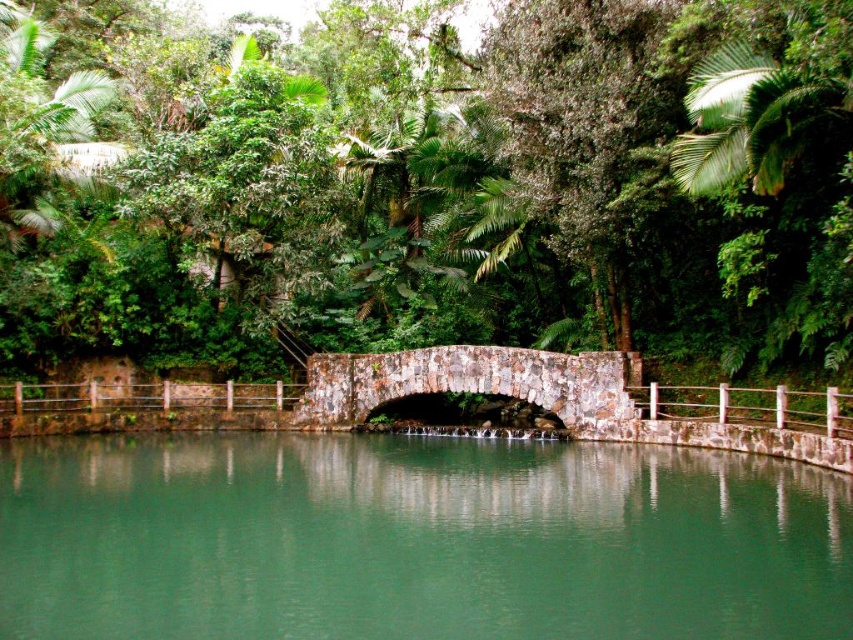
Is green leafy tree at center to the left of rustic stone bridge at center from the viewer's perspective?

Indeed, green leafy tree at center is positioned on the left side of rustic stone bridge at center.

Is green leafy tree at center thinner than rustic stone bridge at center?

Incorrect, green leafy tree at center's width is not less than rustic stone bridge at center's.

Which is in front, point (476, 184) or point (540, 365)?

Point (540, 365) is more forward.

This screenshot has width=853, height=640. In order to click on green leafy tree at center in this screenshot , I will do `click(440, 189)`.

Is the position of green leafy tree at center more distant than that of green stone river at center?

Yes.

What do you see at coordinates (440, 189) in the screenshot?
I see `green leafy tree at center` at bounding box center [440, 189].

Between point (299, 273) and point (595, 492), which one is positioned behind?

The point (299, 273) is behind.

I want to click on green leafy tree at center, so 440,189.

Is point (718, 243) positioned behind point (840, 296)?

Yes, it is behind point (840, 296).

The image size is (853, 640). What do you see at coordinates (440, 189) in the screenshot? I see `green leafy tree at center` at bounding box center [440, 189].

Is point (770, 124) positioned after point (761, 284)?

No, it is not.

At what (x,y) coordinates should I click in order to perform the action: click on green leafy tree at center. Please return your answer as a coordinate pair (x, y). The image size is (853, 640). Looking at the image, I should click on (440, 189).